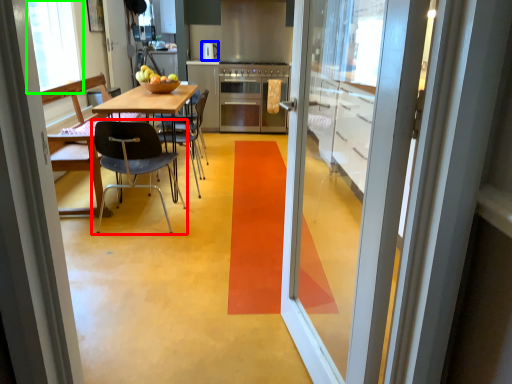
Question: Estimate the real-world distances between objects in this image. Which object is farther from chair (highlighted by a red box), appliance (highlighted by a blue box) or window screen (highlighted by a green box)?

Choices:
 (A) appliance
 (B) window screen

Answer: (A)